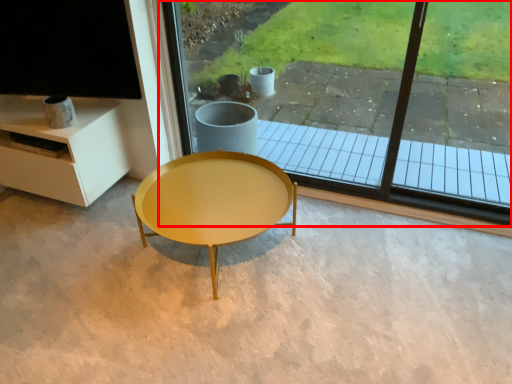
Question: From the image's perspective, where is window (annotated by the red box) located in relation to coffee table in the image?

Choices:
 (A) below
 (B) above

Answer: (B)